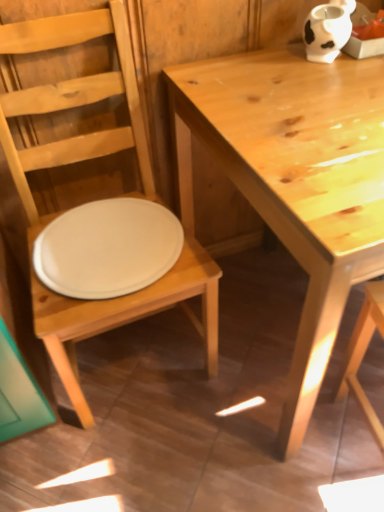
Question: Is white matte plate at center to the left or to the right of white matte cow-shaped vase at upper right in the image?

Choices:
 (A) right
 (B) left

Answer: (B)

Question: Is white matte plate at center inside the boundaries of white matte cow-shaped vase at upper right, or outside?

Choices:
 (A) inside
 (B) outside

Answer: (B)

Question: Estimate the real-world distances between objects in this image. Which object is closer to the matte white plate at left?

Choices:
 (A) light brown wooden table at center
 (B) white matte cow-shaped vase at upper right
 (C) white matte plate at center

Answer: (C)

Question: Estimate the real-world distances between objects in this image. Which object is closer to the matte white plate at left?

Choices:
 (A) white matte plate at center
 (B) light brown wooden table at center
 (C) white matte cow-shaped vase at upper right

Answer: (A)